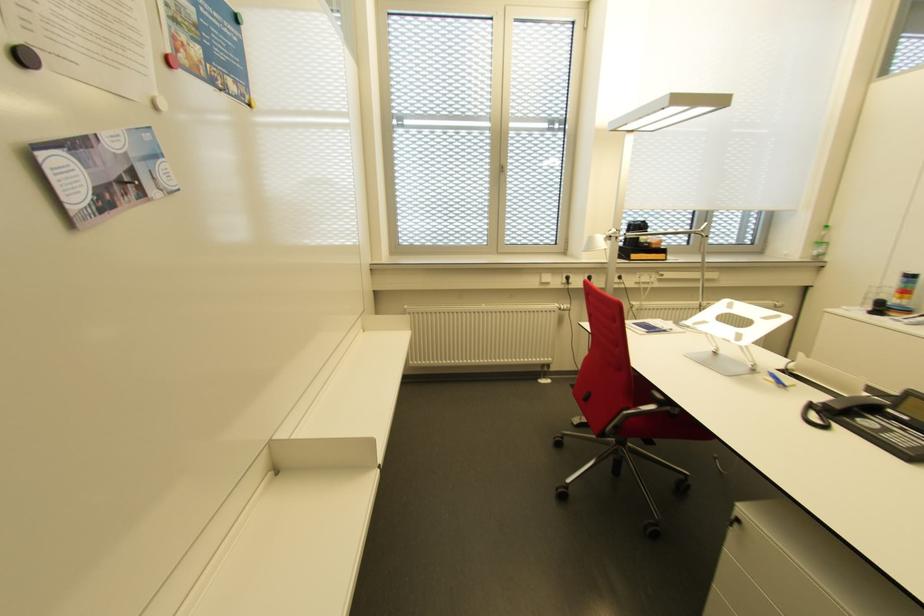
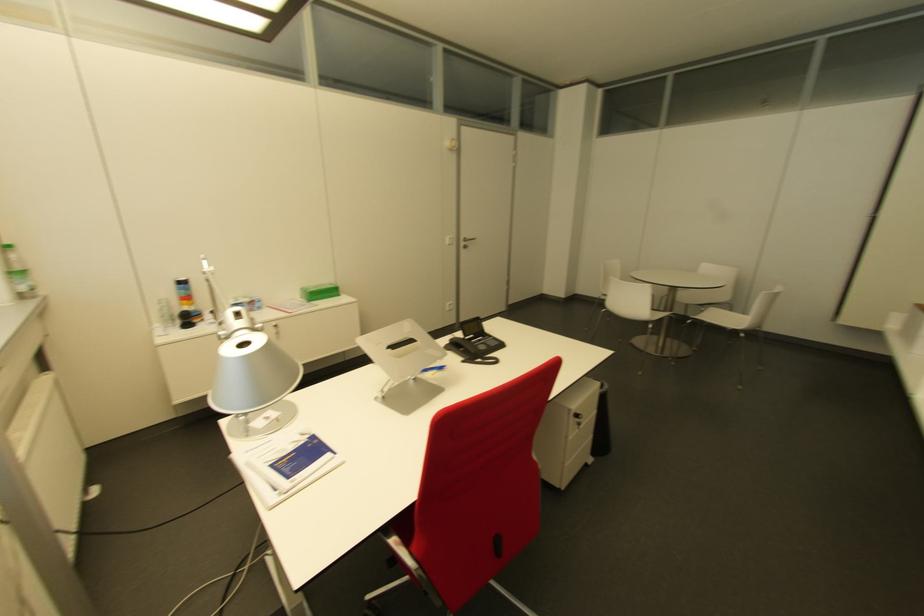
Find the pixel in the second image that matches (819,251) in the first image.

(27, 284)